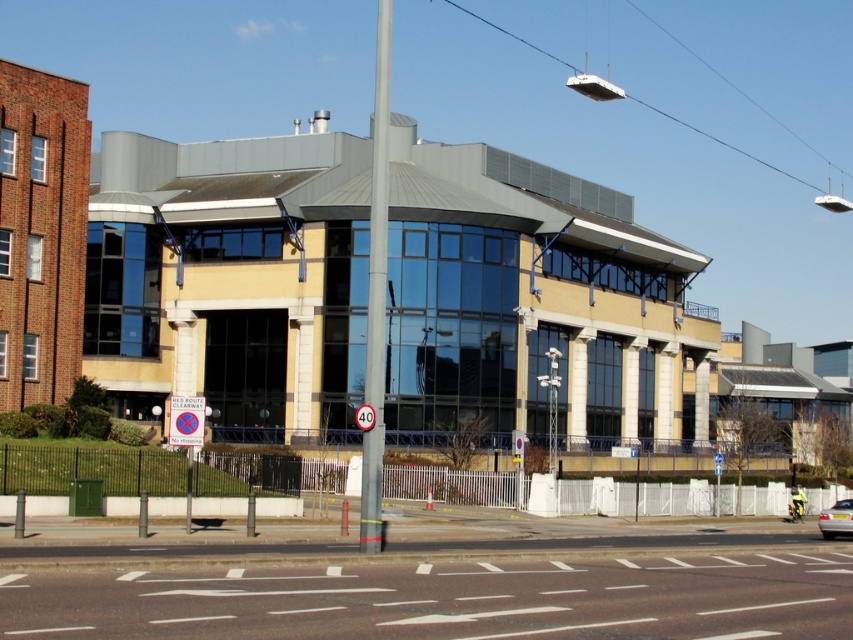
Who is lower down, white asphalt at center or red plastic sign at center?

Positioned lower is white asphalt at center.

Is white asphalt at center thinner than red plastic sign at center?

No.

Between point (467, 576) and point (190, 412), which one is positioned behind?

Point (190, 412)

Locate an element on the screen. This screenshot has height=640, width=853. white asphalt at center is located at coordinates (451, 598).

From the picture: Which is below, metallic pole at center or red plastic sign at center?

red plastic sign at center is below.

In the scene shown: Can you confirm if metallic pole at center is positioned below red plastic sign at center?

Actually, metallic pole at center is above red plastic sign at center.

Does point (381, 198) lie in front of point (173, 424)?

That is True.

This screenshot has width=853, height=640. I want to click on metallic pole at center, so click(x=376, y=292).

Does metallic pole at center appear over silver metallic car at lower right?

Yes, metallic pole at center is above silver metallic car at lower right.

How much distance is there between metallic pole at center and silver metallic car at lower right?

metallic pole at center is 79.11 meters from silver metallic car at lower right.

Is point (358, 532) farther from camera compared to point (824, 524)?

No, it is in front of (824, 524).

You are a GUI agent. You are given a task and a screenshot of the screen. Output one action in this format:
    pyautogui.click(x=<x>, y=<y>)
    Task: Click on the metallic pole at center
    The image size is (853, 640).
    Given the screenshot: What is the action you would take?
    point(376,292)